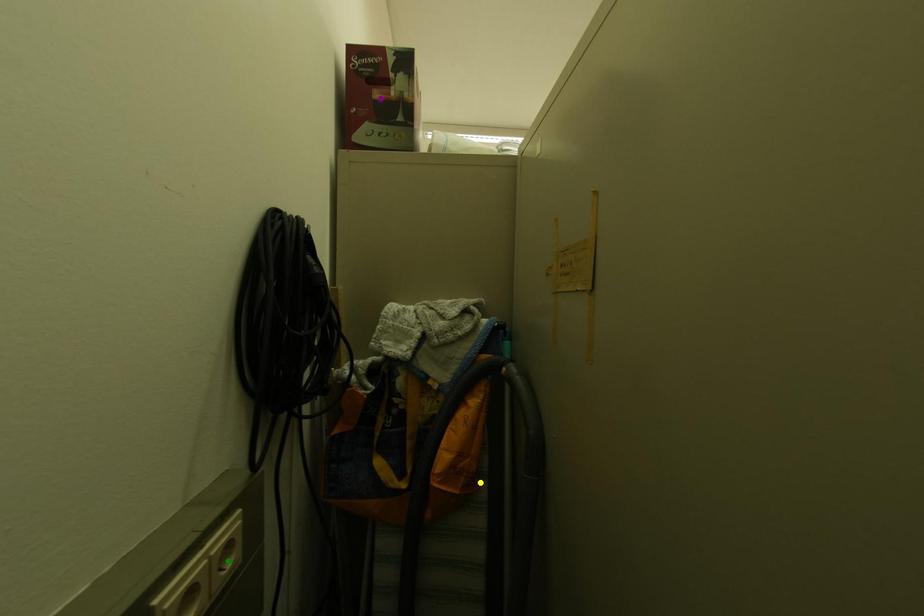
Order these from nearest to farthest:
purple point, yellow point, green point

purple point < yellow point < green point